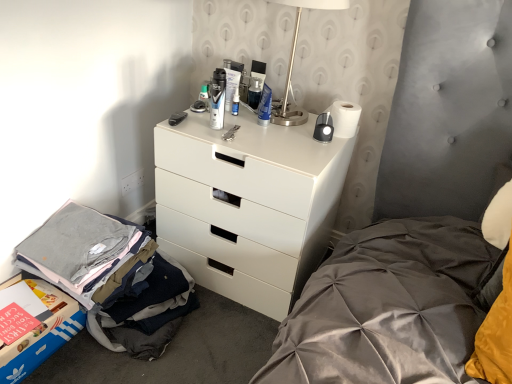
Identify the location of free location in front of blue glossy bottle at center, the second toiletry viewed from the right. (234, 131).